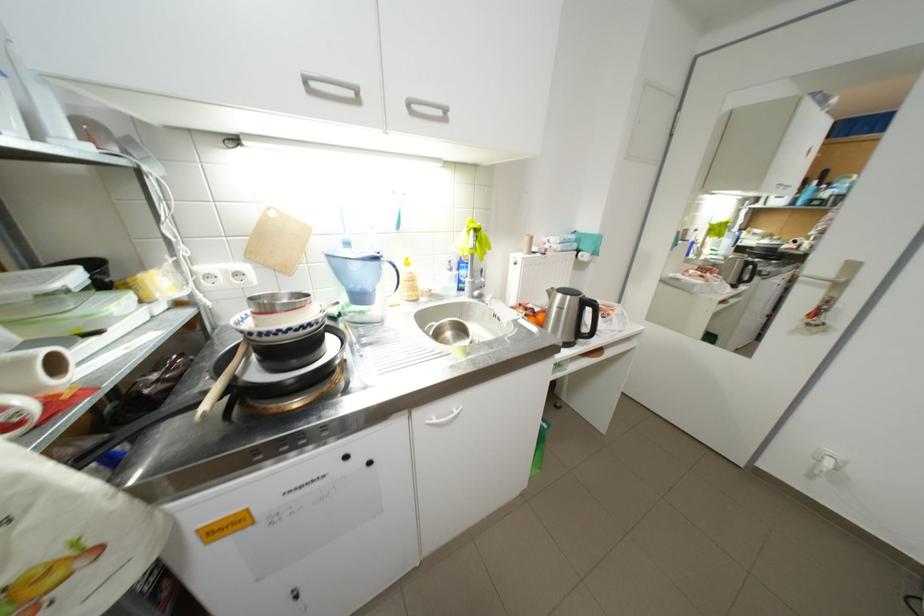
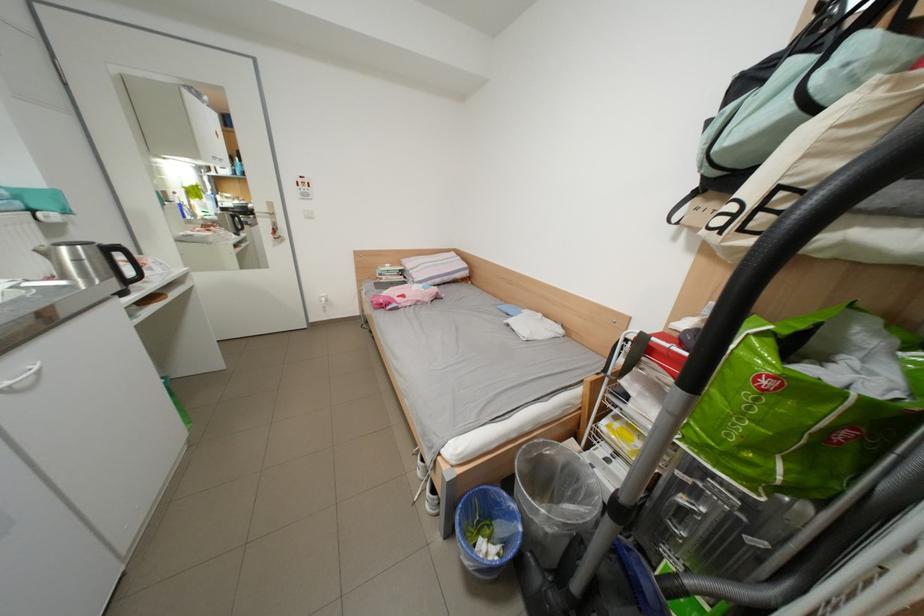
How did the camera likely rotate?

The rotation direction of the camera is right-down.